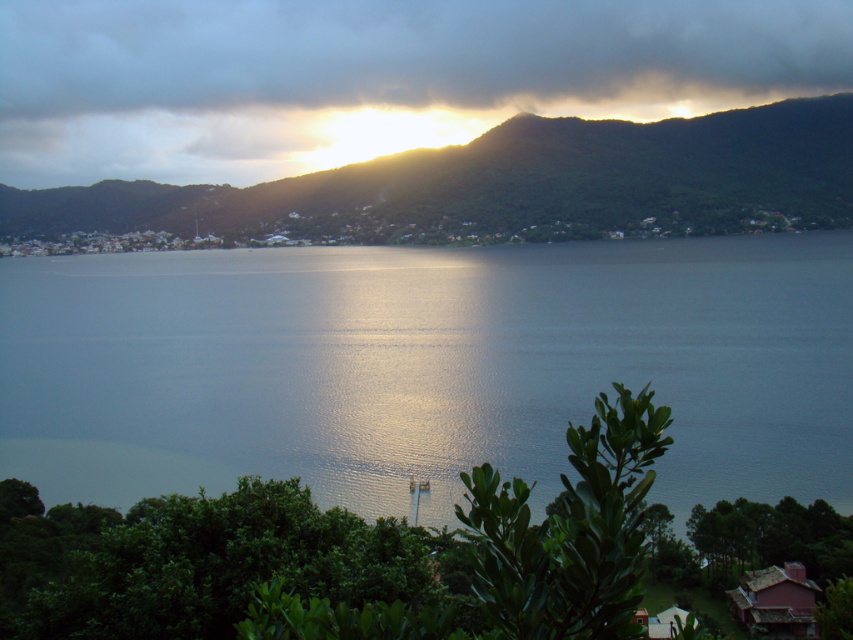
You are an artist planning to paint the scene. You want to place the glistening water at center and the green matte mountain at upper center in your painting. According to the scene, which object should be placed to the right of the other?

The glistening water at center is positioned on the right side of green matte mountain at upper center, so the glistening water at center should be placed to the right of the green matte mountain at upper center.

You are standing at the point closest to the viewer in the image. Which of the two points, point [201,6] or point [457,220], is farther away from you?

Point [201,6] is behind point [457,220], so it is farther away from you.